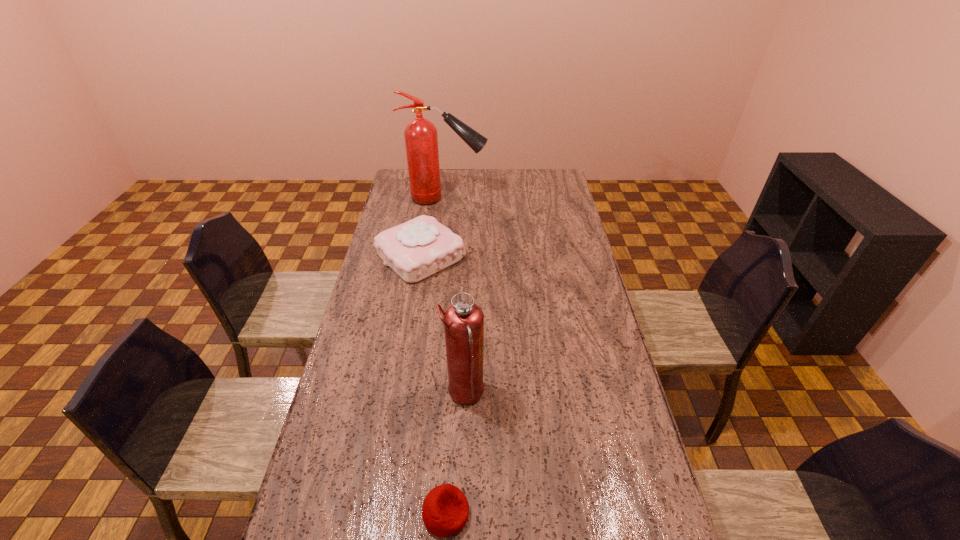
Image resolution: width=960 pixels, height=540 pixels. In order to click on vacant position located 0.070m on the right of the cake in this screenshot , I will do `click(483, 256)`.

The image size is (960, 540). I want to click on vacant region located on the seat area of the nearest object, so click(x=611, y=513).

Identify the location of object at the far edge. This screenshot has width=960, height=540. (421, 140).

The width and height of the screenshot is (960, 540). I want to click on fire extinguisher situated at the left edge, so click(x=421, y=140).

In order to click on cake that is at the left edge in this screenshot , I will do `click(416, 249)`.

The image size is (960, 540). Find the location of `object that is at the far left corner`. object that is at the far left corner is located at coordinates (421, 140).

Where is `vacant space at the far edge`? vacant space at the far edge is located at coordinates (522, 170).

I want to click on free space at the left edge of the desktop, so click(409, 208).

Where is `vacant space at the right edge of the desktop`? This screenshot has width=960, height=540. vacant space at the right edge of the desktop is located at coordinates (615, 406).

Locate an element on the screen. The image size is (960, 540). free spot between the shorter fire extinguisher and the third tallest object is located at coordinates (443, 325).